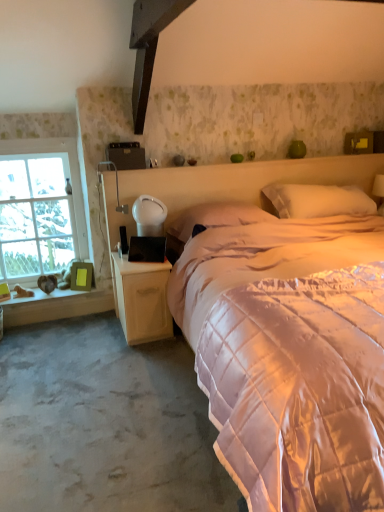
Question: From a real-world perspective, is white glossy table lamp at lower left, which appears as the 2th table lamp when viewed from the left, above or below clear glass window at left?

Choices:
 (A) above
 (B) below

Answer: (A)

Question: From the image's perspective, is white glossy table lamp at lower left, placed as the 1th table lamp when sorted from right to left, positioned above or below clear glass window at left?

Choices:
 (A) above
 (B) below

Answer: (B)

Question: Which object is positioned closest to the wooden nightstand at lower left?

Choices:
 (A) silky white pillow at center, the first pillow in the left-to-right sequence
 (B) white glossy table lamp at lower left, which appears as the 2th table lamp when viewed from the left
 (C) matte white table lamp at left, which is the second table lamp in right-to-left order
 (D) lavender quilted bed at center
 (E) white quilted pillow at upper center, the first pillow in the right-to-left sequence

Answer: (B)

Question: Which of these objects is positioned farthest from the white quilted pillow at upper center, the second pillow in the left-to-right sequence?

Choices:
 (A) gray carpet at lower left
 (B) clear glass window at left
 (C) woodenwoodenwindow sill at left
 (D) wooden nightstand at lower left
 (E) white glossy table lamp at lower left, which appears as the 2th table lamp when viewed from the left

Answer: (B)